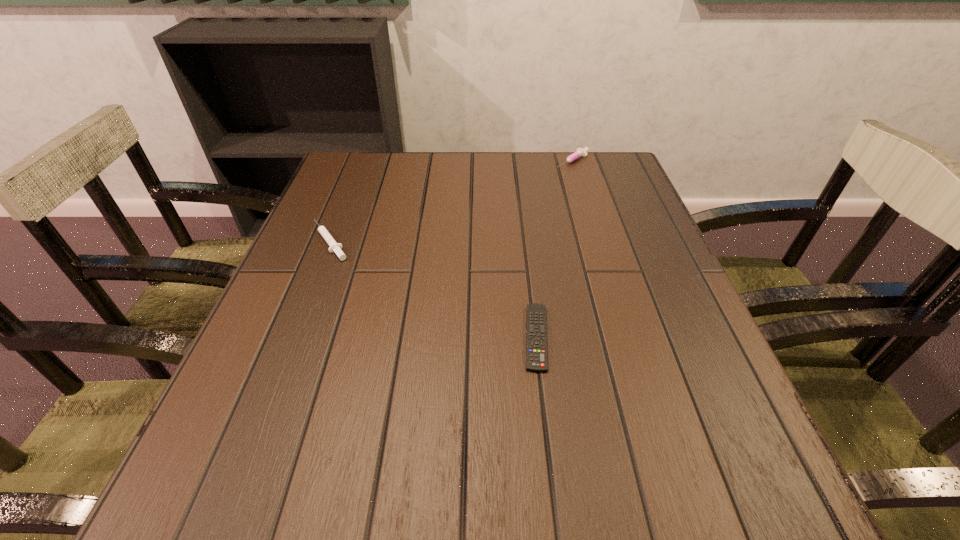
Where is `unoccupied area between the second nearest object and the farther syringe`? This screenshot has width=960, height=540. unoccupied area between the second nearest object and the farther syringe is located at coordinates (451, 201).

Where is `vacant area between the nearer syringe and the farthest object`? This screenshot has width=960, height=540. vacant area between the nearer syringe and the farthest object is located at coordinates (451, 201).

This screenshot has width=960, height=540. Identify the location of vacant space that's between the rightmost object and the second shortest object. (451, 201).

You are a GUI agent. You are given a task and a screenshot of the screen. Output one action in this format:
    pyautogui.click(x=<x>, y=<y>)
    Task: Click on the vacant space that's between the tallest object and the left syringe
    This screenshot has width=960, height=540.
    Given the screenshot: What is the action you would take?
    pyautogui.click(x=451, y=201)

Where is `empty location between the farther syringe and the nearer syringe`? empty location between the farther syringe and the nearer syringe is located at coordinates (451, 201).

Find the location of a particular element. empty space between the shortest object and the second farthest object is located at coordinates (433, 289).

This screenshot has height=540, width=960. I want to click on vacant area that lies between the taller syringe and the second shortest object, so click(x=451, y=201).

Find the location of a particular element. free spot between the left syringe and the shortest object is located at coordinates (433, 289).

Where is `vacant space that's between the left syringe and the second object from left to right`? vacant space that's between the left syringe and the second object from left to right is located at coordinates (433, 289).

At what (x,y) coordinates should I click in order to perform the action: click on object that is the closest to the shorter syringe. Please return your answer as a coordinate pair (x, y). The image size is (960, 540). Looking at the image, I should click on (536, 333).